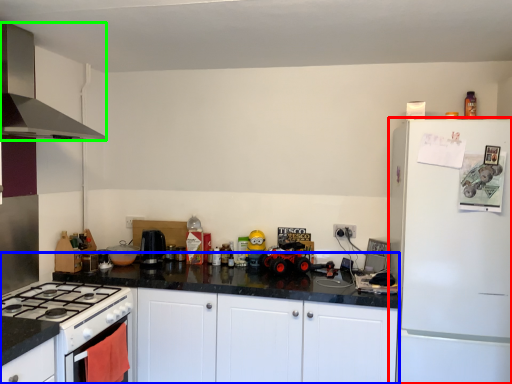
Question: Which is nearer to the refrigerator (highlighted by a red box)? counter (highlighted by a blue box) or kitchen appliance (highlighted by a green box).

Choices:
 (A) counter
 (B) kitchen appliance

Answer: (A)